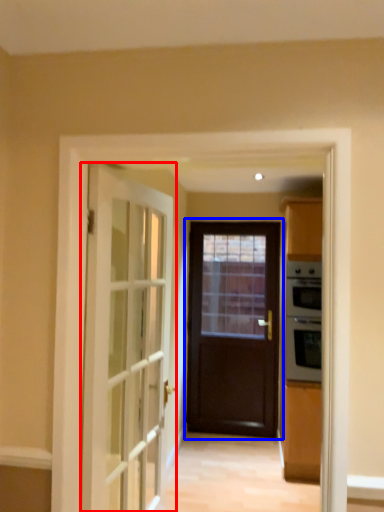
Question: Which of the following is the farthest to the observer, door (highlighted by a red box) or door (highlighted by a blue box)?

Choices:
 (A) door
 (B) door

Answer: (B)